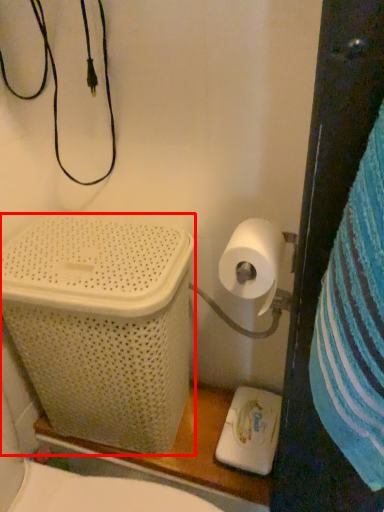
Question: From the image, what is the correct spatial relationship of laundry basket (annotated by the red box) in relation to toilet paper?

Choices:
 (A) left
 (B) right

Answer: (A)